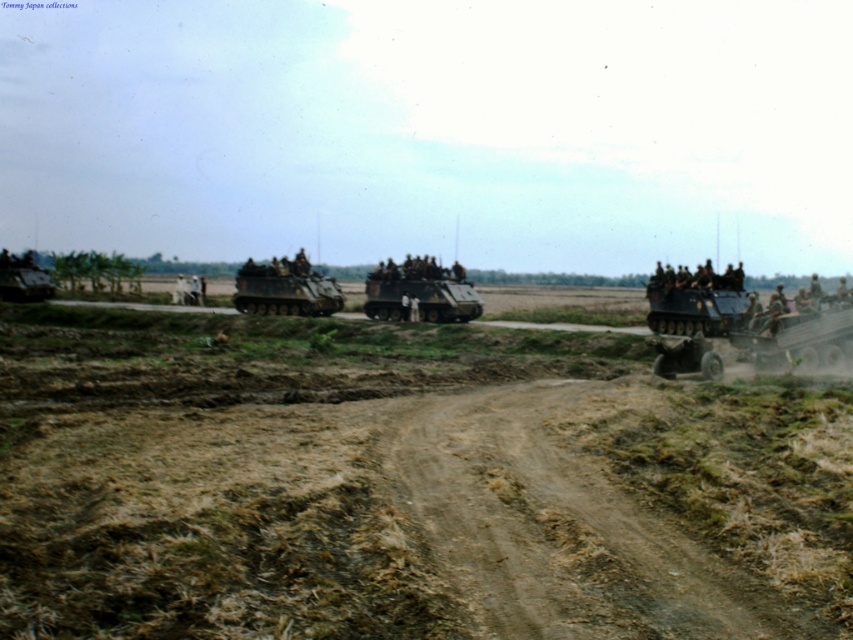
You are a military planner analyzing the convoy route. The point at coordinates (695, 300) marks the location of an object. Which object is located at this point?

The point at coordinates (695, 300) marks the location of the matte black armored personnel carrier at right.

You are a military planner assessing the convoy route. The convoy includes a matte black armored personnel carrier at right and a matte green tank at lower left. Given the terrain, which vehicle might have more difficulty navigating the narrow sections of the dirt path?

The matte green tank at lower left might have more difficulty navigating the narrow sections of the dirt path because it is wider than the matte black armored personnel carrier at right.

You are a driver navigating a convoy through a rural area. You need to ensure your matte green tank at center stays on the brown dirt track at center. Based on the scene, is the track wide enough for the tank to stay entirely on it without any part hanging off?

The brown dirt track at center has a smaller size compared to matte green tank at center, meaning the tank is larger. Therefore, the track might not be wide enough for the matte green tank at center to stay entirely on it without parts hanging off.